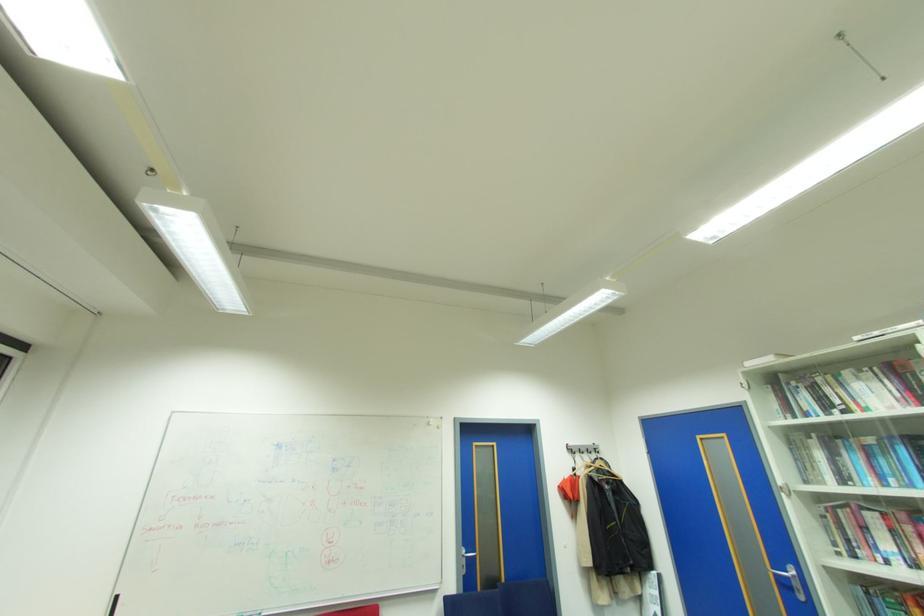
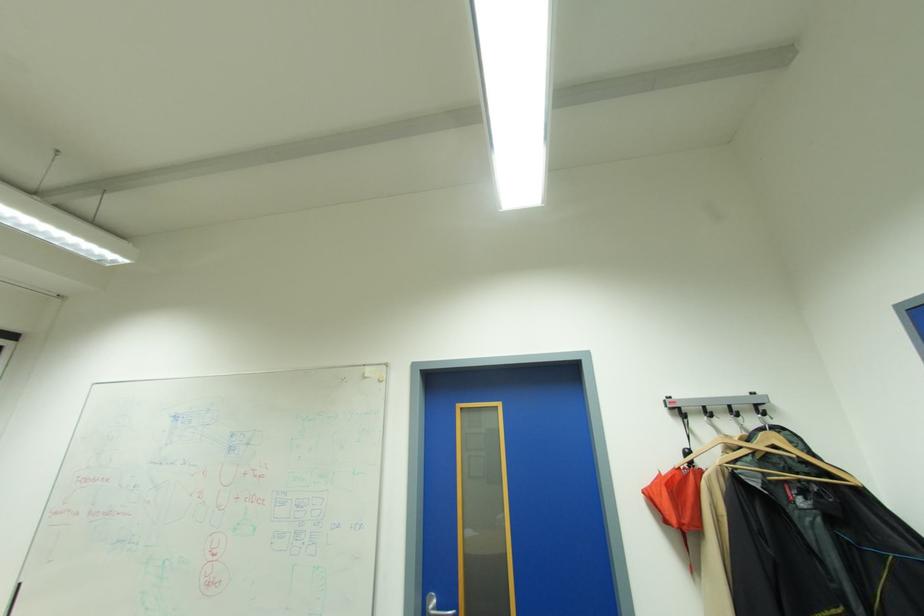
Find the pixel in the second image that matches [585,452] in the first image.

(712, 413)